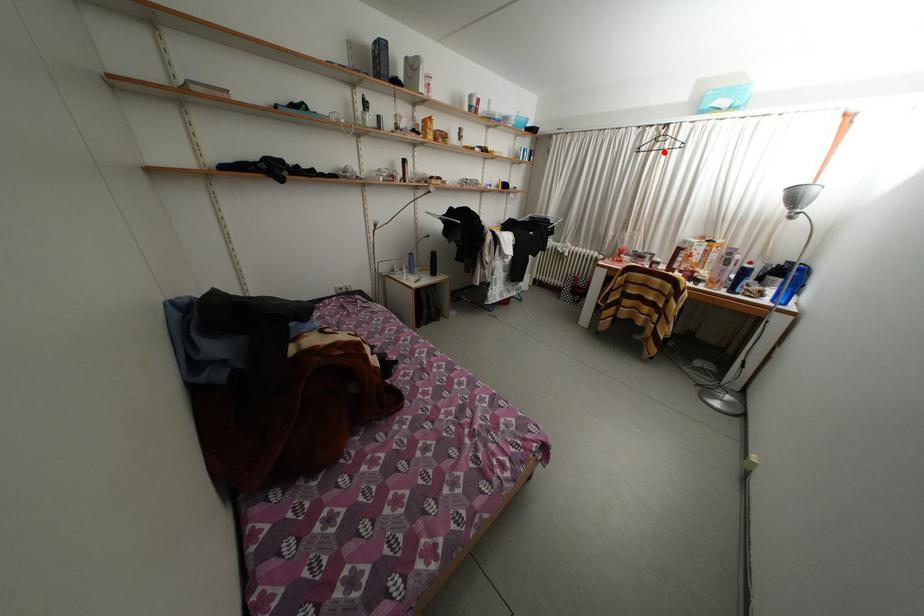
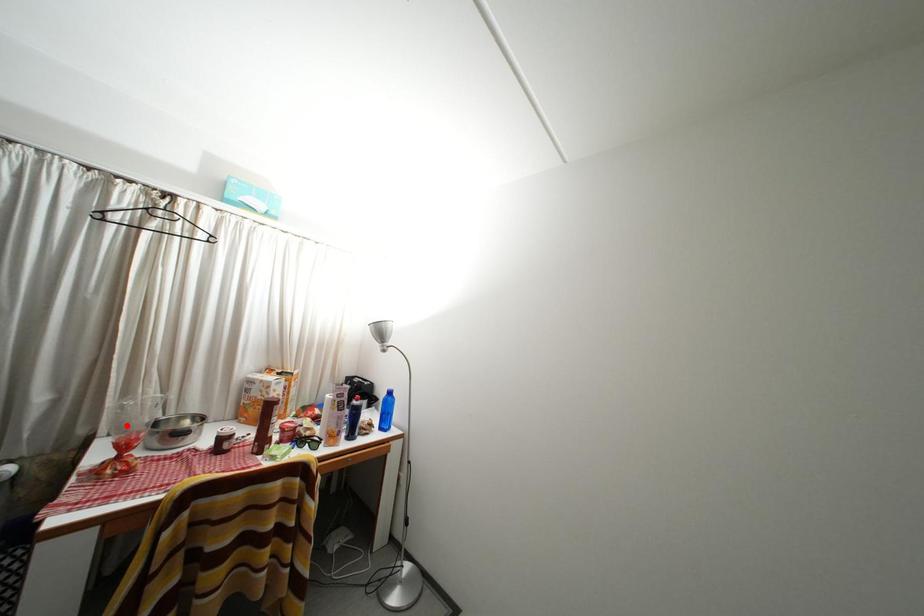
I am providing you with two images of the same scene from different viewpoints. A red point is marked on the first image and another point is marked on the second image. Is the marked point in image1 the same physical position as the marked point in image2?

No